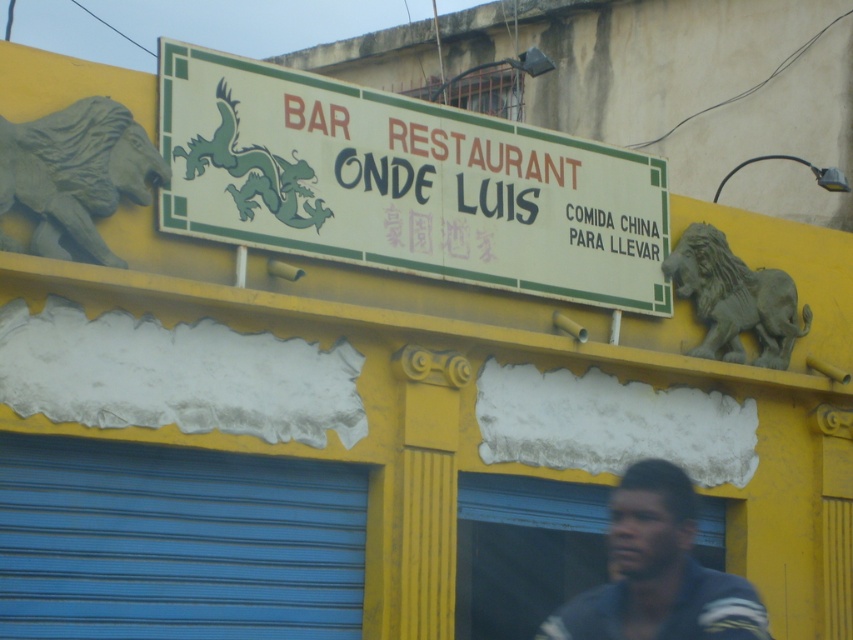
Question: Is blue metallic garage door at lower left below gray stone lion at right?

Choices:
 (A) no
 (B) yes

Answer: (B)

Question: Does white paper sign at center have a smaller size compared to gray stone lion at upper left?

Choices:
 (A) yes
 (B) no

Answer: (B)

Question: Which point is closer to the camera?

Choices:
 (A) gray stone lion at right
 (B) gray stone lion at upper left

Answer: (B)

Question: Which object is positioned closest to the gray stone lion at right?

Choices:
 (A) white paper sign at center
 (B) gray stone lion at upper left

Answer: (A)

Question: In this image, where is blue metallic garage door at lower left located relative to green matte dragon at center?

Choices:
 (A) right
 (B) left

Answer: (B)

Question: Which point is farther to the camera?

Choices:
 (A) (62, 444)
 (B) (715, 317)
 (C) (71, 109)

Answer: (B)